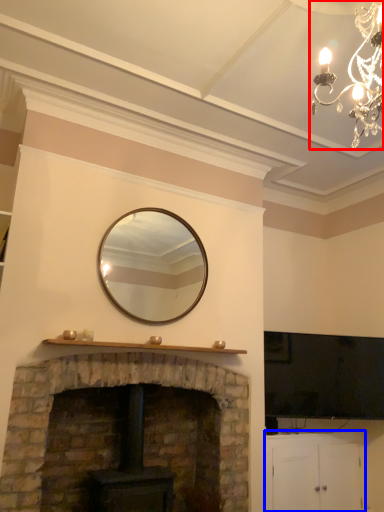
Question: Which object is closer to the camera taking this photo, lamp (highlighted by a red box) or cabinetry (highlighted by a blue box)?

Choices:
 (A) lamp
 (B) cabinetry

Answer: (A)